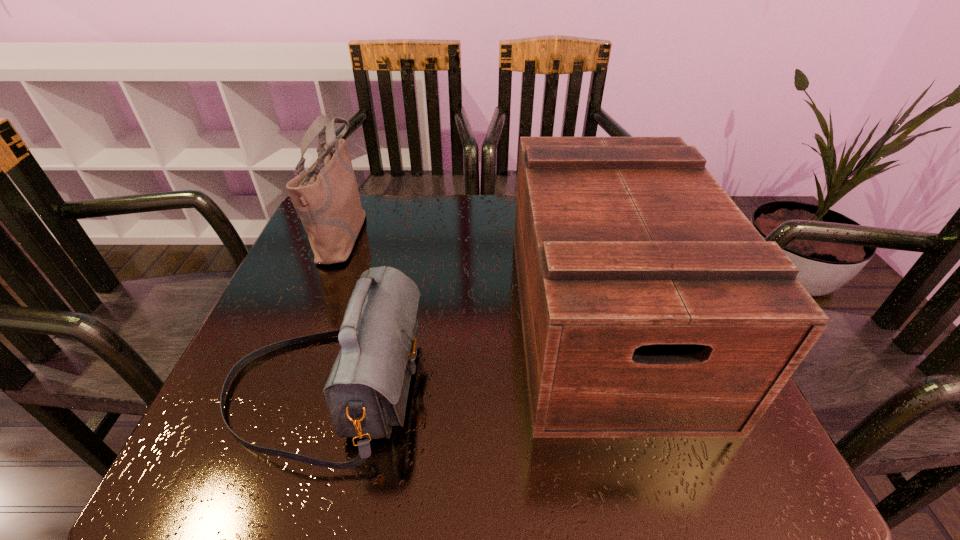
You are a GUI agent. You are given a task and a screenshot of the screen. Output one action in this format:
    pyautogui.click(x=<x>, y=<y>)
    Task: Click on the taller shoulder bag
    
    Given the screenshot: What is the action you would take?
    pyautogui.click(x=326, y=197)

You are a GUI agent. You are given a task and a screenshot of the screen. Output one action in this format:
    pyautogui.click(x=<x>, y=<y>)
    Task: Click on the box
    
    Given the screenshot: What is the action you would take?
    pyautogui.click(x=651, y=307)

What are the coordinates of `the shorter shoulder bag` in the screenshot? It's located at (366, 392).

This screenshot has width=960, height=540. In order to click on the nearer shoulder bag in this screenshot , I will do `click(366, 392)`.

The width and height of the screenshot is (960, 540). What are the coordinates of `vacant space located on the front-facing side of the farther shoulder bag` in the screenshot? It's located at (483, 234).

Find the location of a particular element. The image size is (960, 540). free spot located on the back of the box is located at coordinates (575, 216).

Locate an element on the screen. Image resolution: width=960 pixels, height=540 pixels. free spot located 0.250m on the right of the shortest object is located at coordinates (567, 388).

In order to click on shoulder bag present at the far edge in this screenshot , I will do `click(326, 197)`.

Identify the location of box present at the far edge. This screenshot has width=960, height=540. 651,307.

Where is `box present at the near edge`? box present at the near edge is located at coordinates (651, 307).